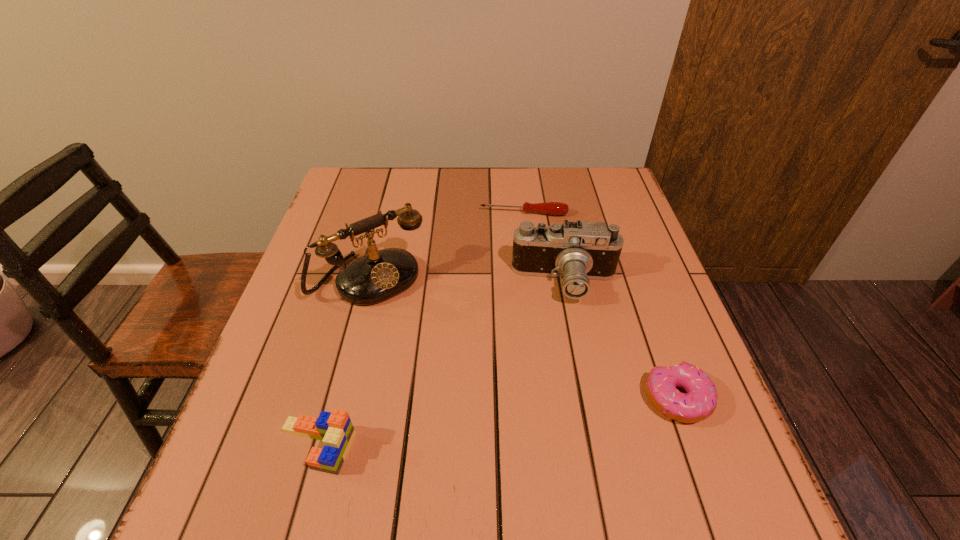
Find the location of a particular element. The image size is (960, 540). vacant space at the far right corner of the desktop is located at coordinates (605, 175).

The height and width of the screenshot is (540, 960). Find the location of `vacant space that is in between the second tallest object and the third tallest object`. vacant space that is in between the second tallest object and the third tallest object is located at coordinates (441, 364).

The width and height of the screenshot is (960, 540). Find the location of `empty space between the screwdriver and the doughnut`. empty space between the screwdriver and the doughnut is located at coordinates (601, 306).

Where is `free point between the camera and the third tallest object`? The image size is (960, 540). free point between the camera and the third tallest object is located at coordinates (441, 364).

The image size is (960, 540). What are the coordinates of `vacant space in between the shortest object and the Lego` in the screenshot? It's located at (420, 330).

Where is `vacant region between the third tallest object and the camera`? vacant region between the third tallest object and the camera is located at coordinates (x=441, y=364).

You are a GUI agent. You are given a task and a screenshot of the screen. Output one action in this format:
    pyautogui.click(x=<x>, y=<y>)
    Task: Click on the free spot between the telephone and the third shortest object
    The width and height of the screenshot is (960, 540).
    Given the screenshot: What is the action you would take?
    click(x=344, y=363)

Locate an element on the screen. This screenshot has height=540, width=960. vacant space that's between the second tallest object and the telephone is located at coordinates (468, 281).

This screenshot has width=960, height=540. Find the location of `vacant area between the Lego and the tallest object`. vacant area between the Lego and the tallest object is located at coordinates (344, 363).

Where is `unoccupied position between the third tallest object and the tallest object`? unoccupied position between the third tallest object and the tallest object is located at coordinates (344, 363).